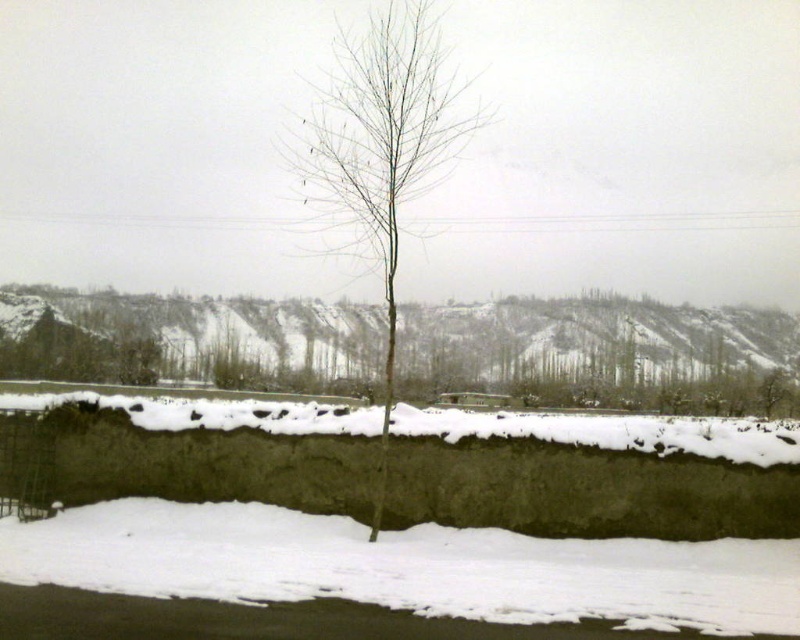
Which is more to the right, bare branches at center or bare wood tree at center?

bare branches at center

Can you confirm if bare branches at center is taller than bare wood tree at center?

No.

Does point (717, 384) lie in front of point (400, 77)?

That is False.

This screenshot has width=800, height=640. What are the coordinates of `bare branches at center` in the screenshot? It's located at (600, 352).

Can you confirm if white powdery snow at lower center is positioned to the left of bare branches at center?

In fact, white powdery snow at lower center is to the right of bare branches at center.

Looking at this image, between white powdery snow at lower center and bare branches at center, which one is positioned lower?

Positioned lower is white powdery snow at lower center.

Which is behind, point (786, 620) or point (574, 371)?

The point (574, 371) is more distant.

Image resolution: width=800 pixels, height=640 pixels. Find the location of `white powdery snow at lower center`. white powdery snow at lower center is located at coordinates (406, 566).

What do you see at coordinates (406, 566) in the screenshot? The width and height of the screenshot is (800, 640). I see `white powdery snow at lower center` at bounding box center [406, 566].

Between white powdery snow at lower center and bare wood tree at center, which one is positioned lower?

white powdery snow at lower center

Where is `white powdery snow at lower center`? This screenshot has width=800, height=640. white powdery snow at lower center is located at coordinates (406, 566).

This screenshot has height=640, width=800. What are the coordinates of `white powdery snow at lower center` in the screenshot? It's located at (406, 566).